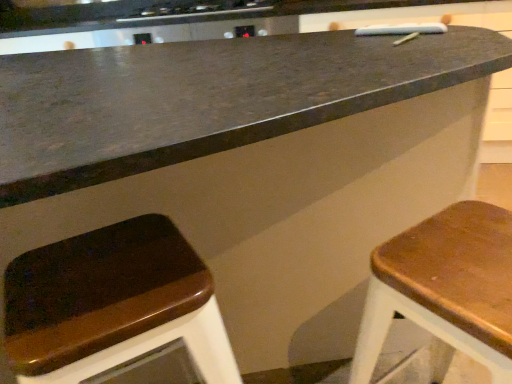
Question: Does black glass stove at upper center have a lesser width compared to wooden seat at right, arranged as the 1th stool when viewed from the right?

Choices:
 (A) yes
 (B) no

Answer: (B)

Question: From a real-world perspective, is black glass stove at upper center on wooden seat at right, the 2th stool positioned from the left?

Choices:
 (A) yes
 (B) no

Answer: (A)

Question: Considering the relative sizes of black glass stove at upper center and wooden seat at right, the 2th stool positioned from the left, in the image provided, is black glass stove at upper center bigger than wooden seat at right, the 2th stool positioned from the left,?

Choices:
 (A) no
 (B) yes

Answer: (A)

Question: Is the depth of black glass stove at upper center less than that of wooden seat at right, arranged as the 1th stool when viewed from the right?

Choices:
 (A) no
 (B) yes

Answer: (A)

Question: Is black glass stove at upper center shorter than wooden seat at right, arranged as the 1th stool when viewed from the right?

Choices:
 (A) yes
 (B) no

Answer: (A)

Question: Is black glass stove at upper center looking in the opposite direction of wooden seat at right, arranged as the 1th stool when viewed from the right?

Choices:
 (A) yes
 (B) no

Answer: (B)

Question: Does wooden seat at lower left, the 1th stool viewed from the left, come behind black glass stove at upper center?

Choices:
 (A) no
 (B) yes

Answer: (A)

Question: Is wooden seat at lower left, the 2th stool positioned from the right, directly adjacent to black glass stove at upper center?

Choices:
 (A) yes
 (B) no

Answer: (B)

Question: Does wooden seat at lower left, the 1th stool viewed from the left, come in front of black glass stove at upper center?

Choices:
 (A) yes
 (B) no

Answer: (A)

Question: Is wooden seat at lower left, the 1th stool viewed from the left, not within black glass stove at upper center?

Choices:
 (A) no
 (B) yes

Answer: (B)

Question: Does wooden seat at lower left, the 1th stool viewed from the left, appear on the right side of black glass stove at upper center?

Choices:
 (A) no
 (B) yes

Answer: (B)

Question: Is wooden seat at lower left, the 1th stool viewed from the left, thinner than black glass stove at upper center?

Choices:
 (A) yes
 (B) no

Answer: (A)

Question: Is black glass stove at upper center oriented away from wooden seat at lower left, the 1th stool viewed from the left?

Choices:
 (A) yes
 (B) no

Answer: (B)